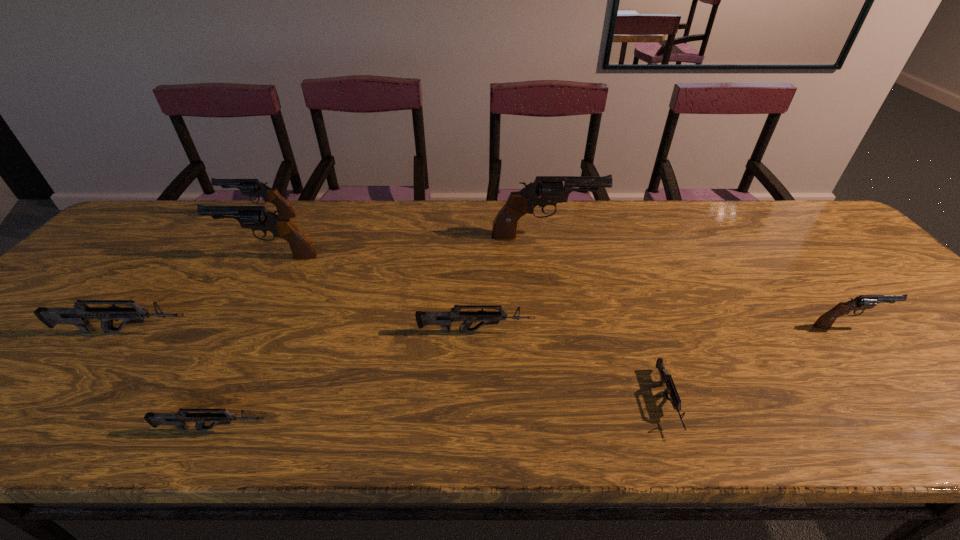
You are a GUI agent. You are given a task and a screenshot of the screen. Output one action in this format:
    pyautogui.click(x=<x>, y=<y>)
    Task: Click on the free space at the far right corner of the desktop
    The image size is (960, 540).
    Given the screenshot: What is the action you would take?
    pyautogui.click(x=798, y=217)

At what (x,y) coordinates should I click in order to perform the action: click on free spot between the second smallest grey gun and the smallest grey gun. Please return your answer as a coordinate pair (x, y). The width and height of the screenshot is (960, 540). Looking at the image, I should click on (441, 415).

This screenshot has height=540, width=960. What are the coordinates of `vacant region between the tallest object and the third farthest black gun` in the screenshot? It's located at (407, 247).

Where is `empty space between the third smallest black gun and the sixth tallest gun`? The image size is (960, 540). empty space between the third smallest black gun and the sixth tallest gun is located at coordinates (372, 294).

This screenshot has width=960, height=540. What are the coordinates of `vacant space that's between the rightmost black gun and the tallest gun` in the screenshot? It's located at (697, 281).

In order to click on empty space that is in between the rightmost object and the farthest object in this screenshot , I will do `click(555, 271)`.

Locate an element on the screen. vacant region between the third grey gun from right to left and the second grey gun from right to left is located at coordinates (345, 380).

The width and height of the screenshot is (960, 540). Identify the location of blank region between the farthest black gun and the biggest grey gun. (193, 274).

Identify the location of vacant space that's between the tallest object and the second tallest object. (407, 247).

The width and height of the screenshot is (960, 540). I want to click on free space that is in between the seventh nearest gun and the second shortest object, so click(x=379, y=333).